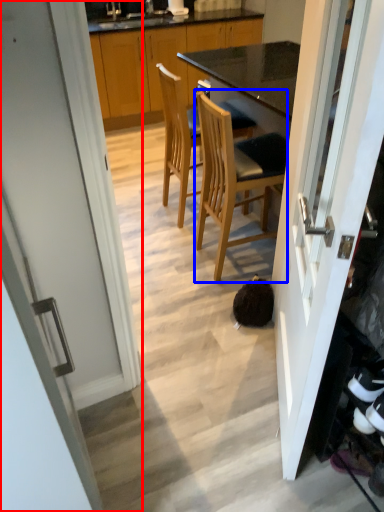
Question: Which of the following is the farthest to the observer, door (highlighted by a red box) or chair (highlighted by a blue box)?

Choices:
 (A) door
 (B) chair

Answer: (B)